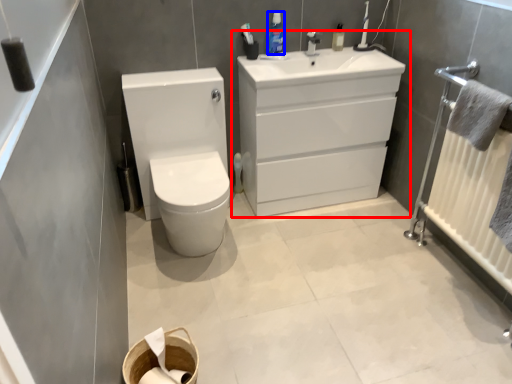
Question: Which of the following is the closest to the observer, bathroom cabinet (highlighted by a red box) or mouthwash (highlighted by a blue box)?

Choices:
 (A) bathroom cabinet
 (B) mouthwash

Answer: (A)